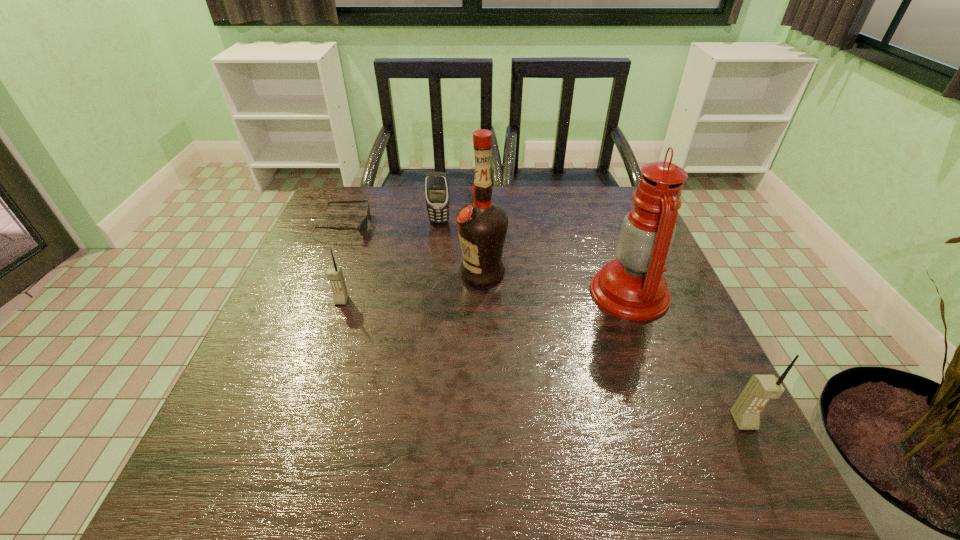
At what (x,y) coordinates should I click in order to perform the action: click on the leftmost cellular telephone. Please return your answer as a coordinate pair (x, y). This screenshot has width=960, height=540. Looking at the image, I should click on (334, 274).

This screenshot has height=540, width=960. Find the location of `the nearest object`. the nearest object is located at coordinates (760, 389).

At what (x,y) coordinates should I click in order to perform the action: click on the nearest cellular telephone. Please return your answer as a coordinate pair (x, y). This screenshot has width=960, height=540. Looking at the image, I should click on (760, 389).

This screenshot has width=960, height=540. Find the location of `the farthest cellular telephone`. the farthest cellular telephone is located at coordinates (436, 183).

I want to click on the third object from left to right, so click(436, 183).

Where is `sunglasses`? The height and width of the screenshot is (540, 960). sunglasses is located at coordinates (362, 228).

Image resolution: width=960 pixels, height=540 pixels. Find the location of `the second object from right to left`. the second object from right to left is located at coordinates point(632,287).

The height and width of the screenshot is (540, 960). What are the coordinates of `the third object from right to left` in the screenshot? It's located at (482, 226).

This screenshot has width=960, height=540. I want to click on vacant space located 0.190m on the front of the leftmost cellular telephone, where the keypad is located, so click(317, 373).

Locate an element on the screen. The image size is (960, 540). free space located 0.220m on the front face of the third object from left to right is located at coordinates (433, 275).